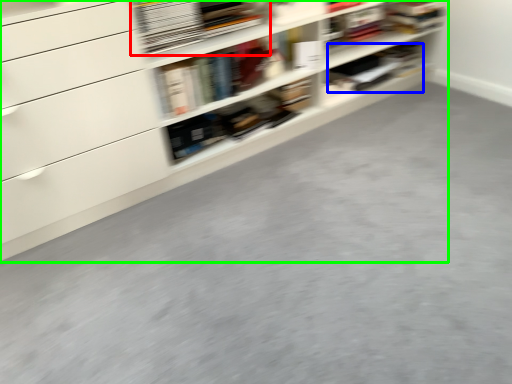
Question: Considering the real-world distances, which object is closest to book (highlighted by a red box)? book (highlighted by a blue box) or shelf (highlighted by a green box).

Choices:
 (A) book
 (B) shelf

Answer: (B)